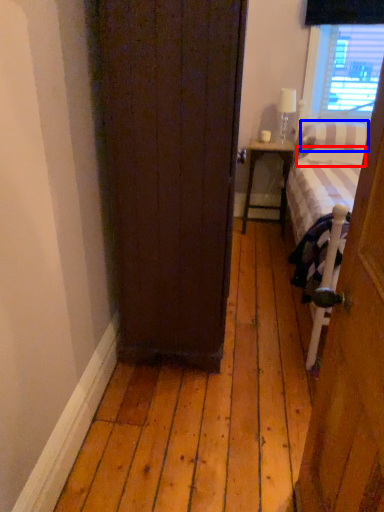
Question: Which object is further to the camera taking this photo, pillow (highlighted by a red box) or pillow (highlighted by a blue box)?

Choices:
 (A) pillow
 (B) pillow

Answer: (A)